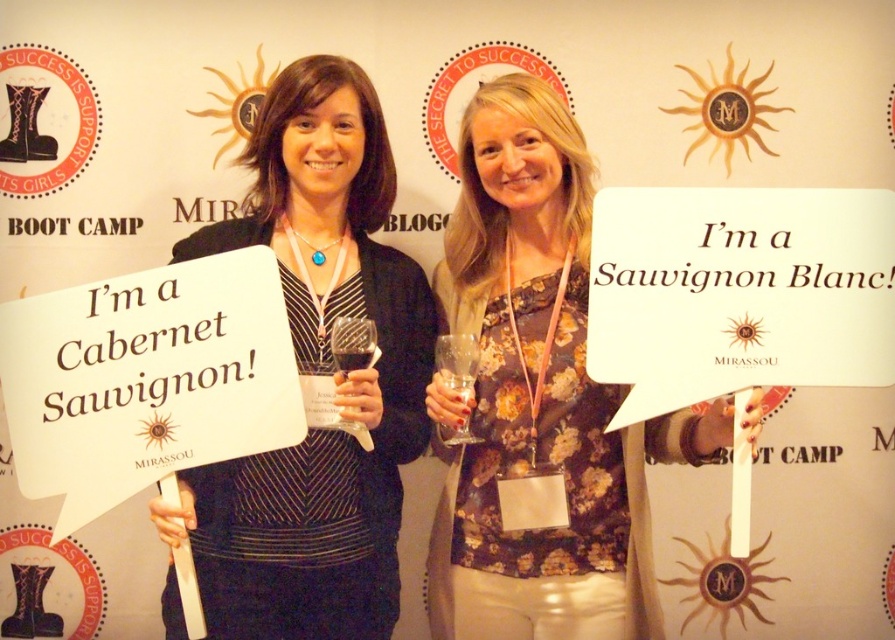
Who is higher up, floral print blouse at center or clear glass wine glass at center?

floral print blouse at center is higher up.

The image size is (895, 640). What are the coordinates of `floral print blouse at center` in the screenshot? It's located at (539, 396).

Does matte black dress at center have a larger size compared to transparent glass wine glass at center?

Correct, matte black dress at center is larger in size than transparent glass wine glass at center.

Where is `matte black dress at center`? matte black dress at center is located at coordinates (314, 372).

Where is `matte black dress at center`? Image resolution: width=895 pixels, height=640 pixels. matte black dress at center is located at coordinates (314, 372).

Is floral print blouse at center further to camera compared to transparent glass wine glass at center?

No, floral print blouse at center is closer to the viewer.

Is point (469, 305) farther from camera compared to point (331, 346)?

Yes, point (469, 305) is farther from viewer.

Measure the distance between point [456,465] and camera.

Point [456,465] is 5.83 feet away from camera.

Locate an element on the screen. The width and height of the screenshot is (895, 640). floral print blouse at center is located at coordinates (539, 396).